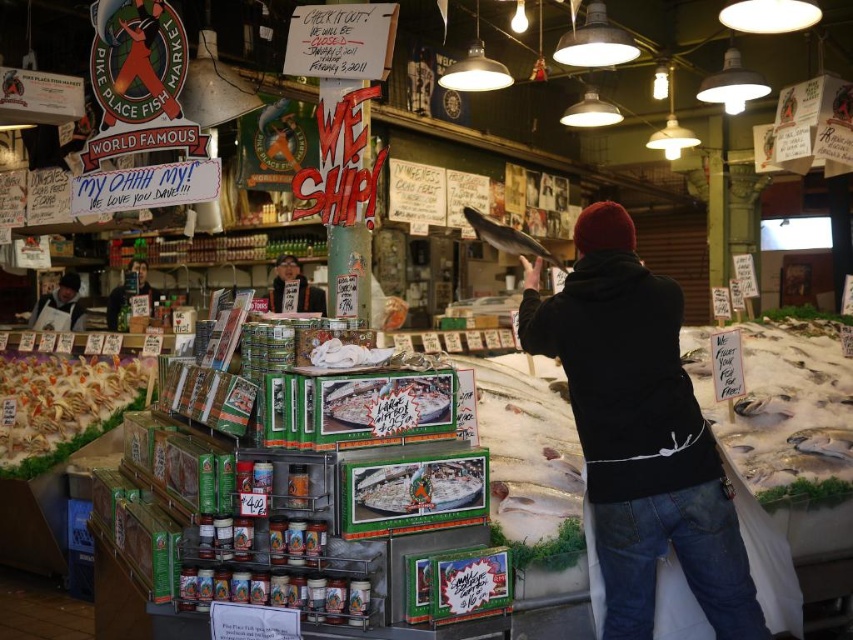
Question: Among these objects, which one is farthest from the camera?

Choices:
 (A) white crumbly food at lower left
 (B) black matte jacket at center
 (C) white paper label at center
 (D) matte black sign at center

Answer: (D)

Question: Can you confirm if black matte jacket at center is bigger than white crumbly food at lower left?

Choices:
 (A) no
 (B) yes

Answer: (A)

Question: Estimate the real-world distances between objects in this image. Which object is farther from the white paper label at center?

Choices:
 (A) white apron at left
 (B) matte black sign at center

Answer: (A)

Question: Is white crumbly food at lower left closer to the viewer compared to white apron at left?

Choices:
 (A) no
 (B) yes

Answer: (B)

Question: Considering the real-world distances, which object is closest to the black matte jacket at center?

Choices:
 (A) matte black sign at center
 (B) white fish at right

Answer: (B)

Question: Does white crumbly food at lower left appear on the left side of white apron at left?

Choices:
 (A) yes
 (B) no

Answer: (B)